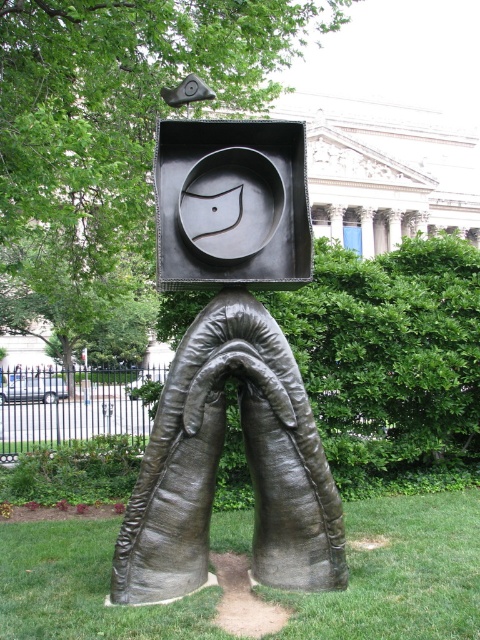
Can you confirm if bronze sculpture at center is thinner than green grass at lower center?

Incorrect, bronze sculpture at center's width is not less than green grass at lower center's.

Can you confirm if bronze sculpture at center is positioned below green grass at lower center?

No, bronze sculpture at center is not below green grass at lower center.

Is point (152, 532) farther from viewer compared to point (432, 579)?

No, it is not.

This screenshot has width=480, height=640. What are the coordinates of `bronze sculpture at center` in the screenshot? It's located at (230, 369).